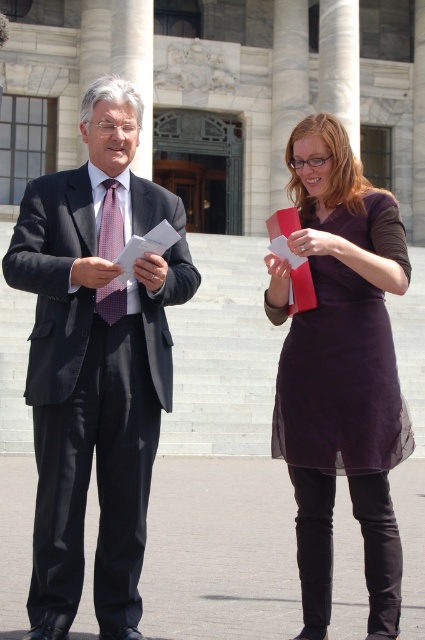
You are a tailor observing the matte black suit at left and the checkered fabric tie at center. Which item would require more fabric to make?

Answer: The matte black suit at left requires more fabric than the checkered fabric tie at center because it is larger in size.

You are a photographer taking a picture of the matte purple dress at center and the checkered fabric tie at center. Which object should you focus on first if you want to capture both in the same frame without moving the camera?

The checkered fabric tie at center should be focused on first because it is above the matte purple dress at center, so adjusting focus starting from the higher object ensures both are in the frame.

You are a photographer positioned at the origin point. You need to capture a photo of the matte black suit at left. What are the coordinates of the object to focus on?

The coordinates of the matte black suit at left are at point (95, 365).